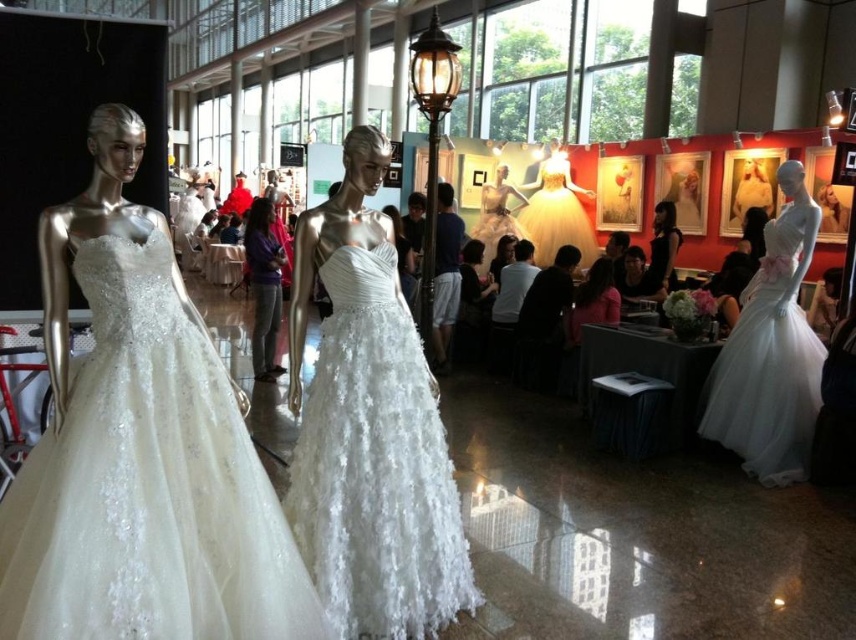
You are a photographer setting up for a photoshoot at a bridal exhibition. You have to position a light source between the ivory lace dress at center and the matte silver mannequin at center. Since the light needs to be placed closer to the smaller object to ensure even illumination, which object should you position the light source near?

The ivory lace dress at center is smaller than the matte silver mannequin at center, so you should position the light source closer to the ivory lace dress at center to achieve even illumination.

You are standing at the point marked as point (782,349) in the image. You want to take a photo of the two mannequins dressed in white wedding gowns. If you move forward by 1 meter, will you still be able to capture both mannequins in the frame?

Since you are currently 4.29 meters away from the point (782,349), moving forward by 1 meter would place you 3.29 meters away. However, without knowing the field of view or focal length of the camera, it is impossible to determine if both mannequins will still fit in the frame.